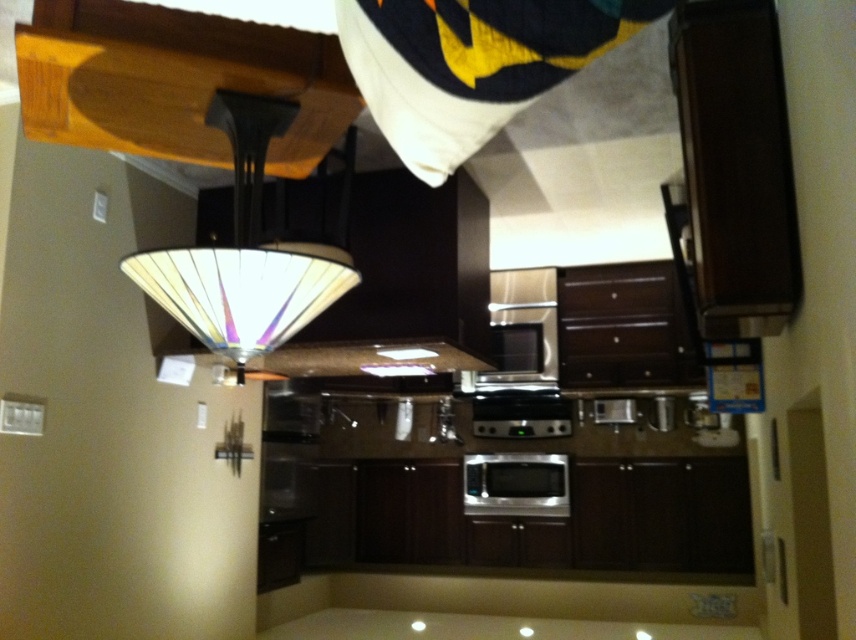
Describe the element at coordinates (242, 253) in the screenshot. This screenshot has width=856, height=640. I see `translucent glass lampshade at upper center` at that location.

Who is more distant from viewer, (342, 260) or (498, 488)?

Point (498, 488)

Who is more distant from viewer, (x=333, y=248) or (x=533, y=506)?

The point (x=533, y=506) is behind.

In order to click on translucent glass lampshade at upper center in this screenshot , I will do `click(242, 253)`.